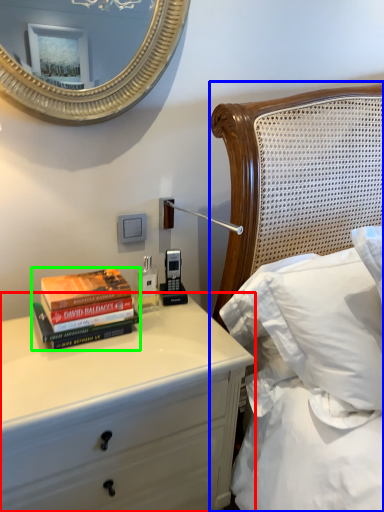
Question: Which object is the farthest from chest of drawers (highlighted by a red box)? Choose among these: bed (highlighted by a blue box) or book (highlighted by a green box).

Choices:
 (A) bed
 (B) book

Answer: (A)